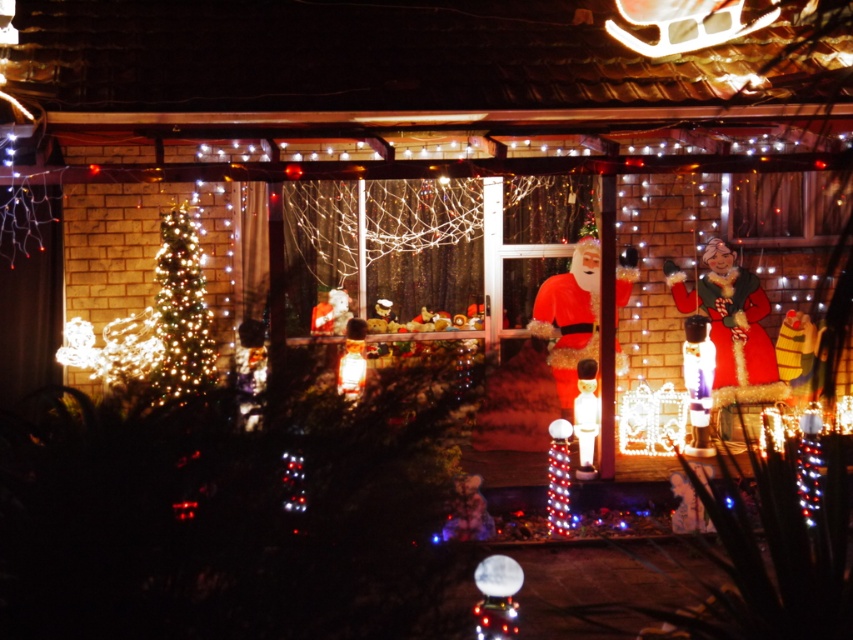
Can you confirm if illuminated plastic tree at left is positioned to the left of matte white figure at center?

Yes, illuminated plastic tree at left is to the left of matte white figure at center.

Does point (201, 387) come closer to viewer compared to point (579, 436)?

Yes, point (201, 387) is in front of point (579, 436).

Locate an element on the screen. The height and width of the screenshot is (640, 853). illuminated plastic tree at left is located at coordinates (181, 312).

Where is `matte red santa at center`? matte red santa at center is located at coordinates (569, 317).

You are a GUI agent. You are given a task and a screenshot of the screen. Output one action in this format:
    pyautogui.click(x=<x>, y=<y>)
    Task: Click on the matte red santa at center
    Image resolution: width=853 pixels, height=640 pixels.
    Given the screenshot: What is the action you would take?
    pyautogui.click(x=569, y=317)

What are the coordinates of `matte red santa at center` in the screenshot? It's located at (569, 317).

Who is positioned more to the right, matte red santa at right or matte red santa at center?

matte red santa at right

Image resolution: width=853 pixels, height=640 pixels. What are the coordinates of `matte red santa at right` in the screenshot? It's located at (730, 328).

The image size is (853, 640). Find the location of `matte red santa at right`. matte red santa at right is located at coordinates (730, 328).